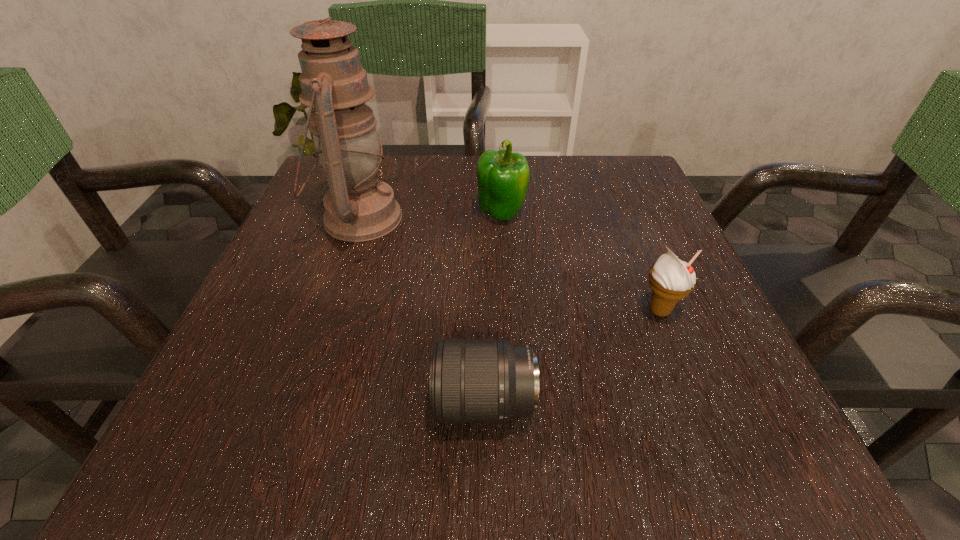
At what (x,y) coordinates should I click in order to perform the action: click on vacant space located 0.270m on the surface of the telephoto lens. Please return your answer as a coordinate pair (x, y). Image resolution: width=960 pixels, height=540 pixels. Looking at the image, I should click on (231, 403).

I want to click on vacant space situated on the surface of the telephoto lens, so tap(254, 403).

Find the location of a particular element. This screenshot has height=540, width=960. free space located on the surface of the telephoto lens is located at coordinates (270, 403).

This screenshot has width=960, height=540. In order to click on oil lamp that is at the far edge in this screenshot , I will do `click(358, 207)`.

Identify the location of bell pepper that is positioned at the far edge. The height and width of the screenshot is (540, 960). (503, 176).

The image size is (960, 540). I want to click on object present at the near edge, so click(471, 380).

Image resolution: width=960 pixels, height=540 pixels. I want to click on object at the left edge, so click(358, 207).

This screenshot has height=540, width=960. I want to click on object that is at the right edge, so click(670, 279).

Identify the location of object present at the far left corner. (358, 207).

Identify the location of free point at the far edge. (400, 201).